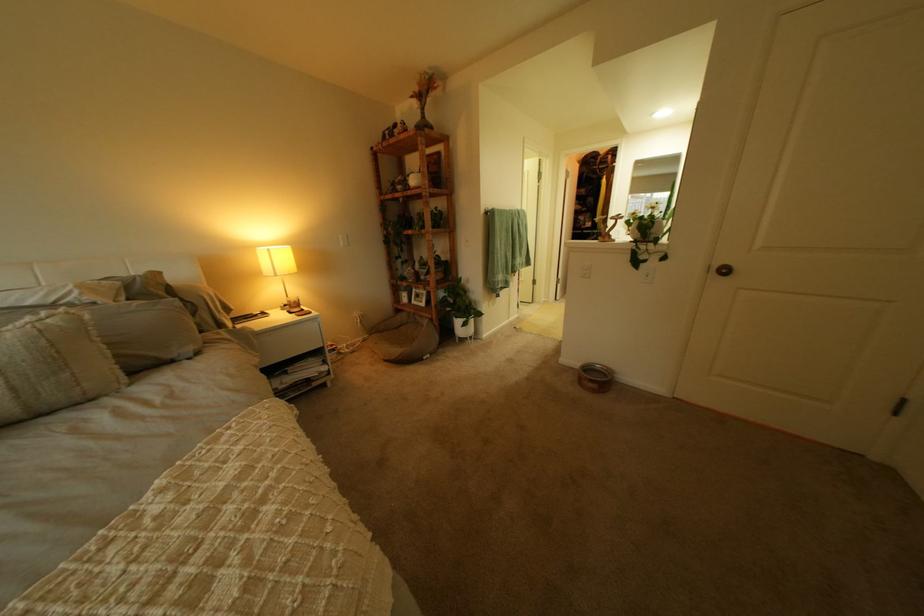
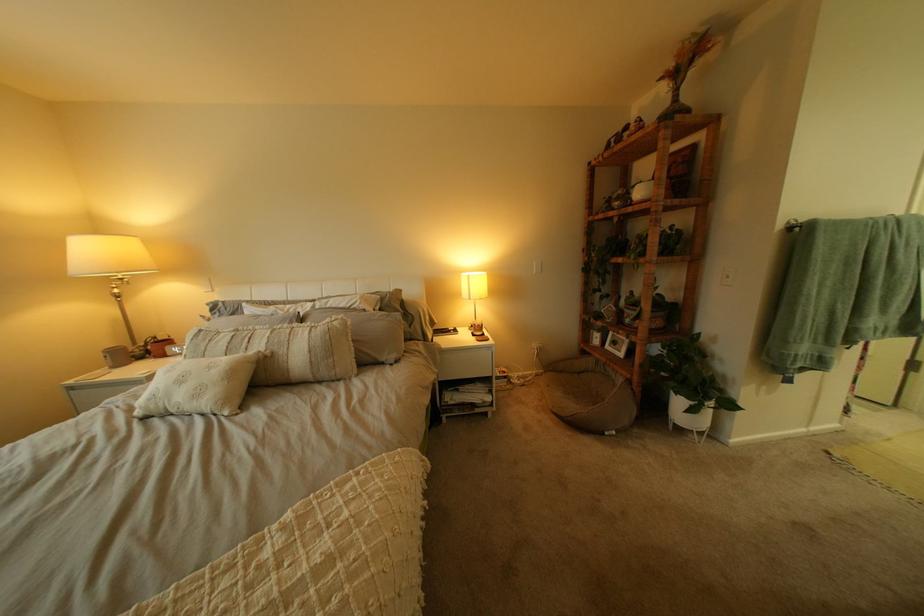
Find the pixel in the second image that matches (285,251) in the first image.

(483, 277)